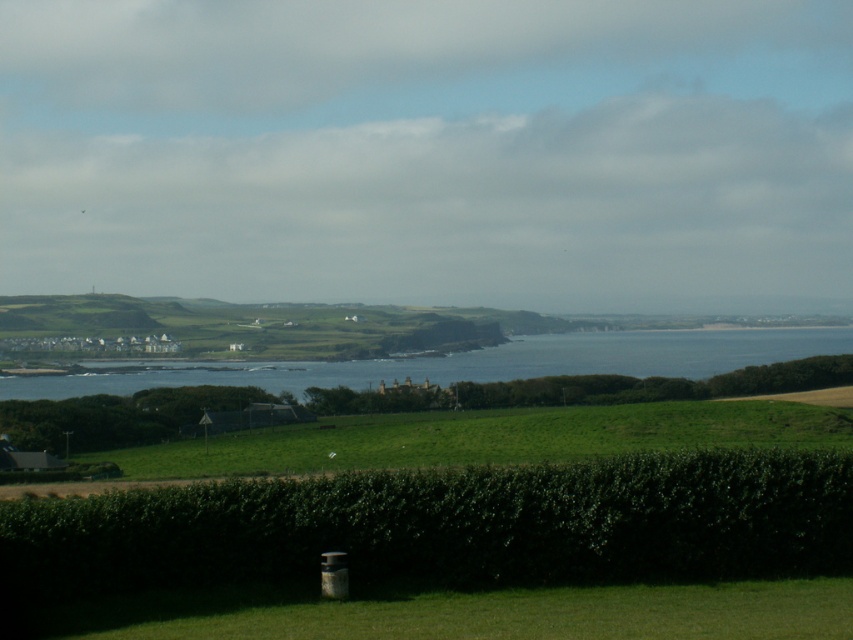
Question: Can you confirm if green leafy hedge at lower center is positioned above blue water at center?

Choices:
 (A) no
 (B) yes

Answer: (A)

Question: Which point is closer to the camera?

Choices:
 (A) (341, 369)
 (B) (780, 499)

Answer: (B)

Question: Is green leafy hedge at lower center wider than blue water at center?

Choices:
 (A) yes
 (B) no

Answer: (B)

Question: Is green leafy hedge at lower center positioned before blue water at center?

Choices:
 (A) yes
 (B) no

Answer: (A)

Question: Which point is farther to the camera?

Choices:
 (A) (450, 488)
 (B) (779, 356)

Answer: (B)